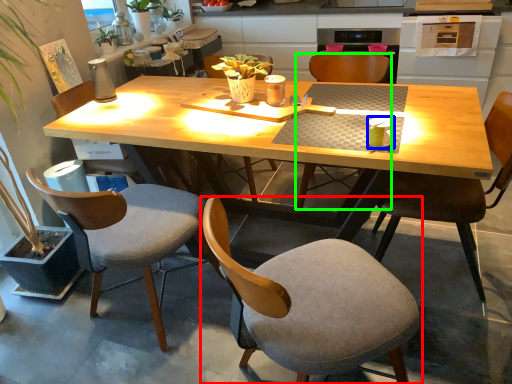
Question: Which is farther away from chair (highlighted by a red box)? coffee cup (highlighted by a blue box) or chair (highlighted by a green box)?

Choices:
 (A) coffee cup
 (B) chair

Answer: (B)